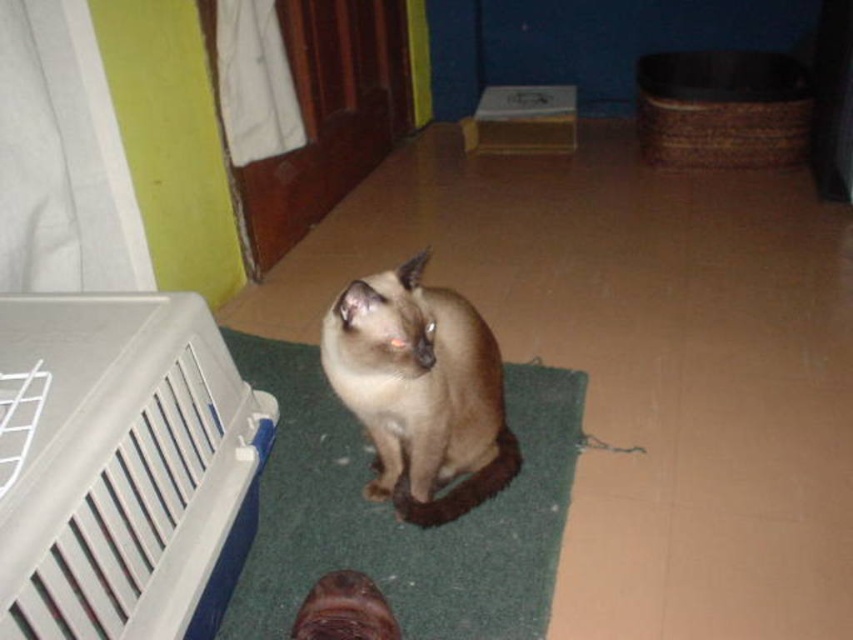
You are a pet sitter who needs to place a new toy for the cat. The toy is 15 cm wide. The white plastic laundry basket at lower left is on the left side of the green carpet at center. Can the toy fit between them?

The white plastic laundry basket at lower left is positioned on the left side of green carpet at center, but the distance between them isn

You are a cat owner who wants to move your cat from the green carpet at center to the white plastic pet carrier with a blue base on the left. Which direction should you move the smokey brown fur cat at center to reach the carrier?

The green carpet at center is to the left of the smokey brown fur cat at center, so to move the cat towards the white plastic pet carrier with a blue base on the left, you should move the smokey brown fur cat at center to the left.